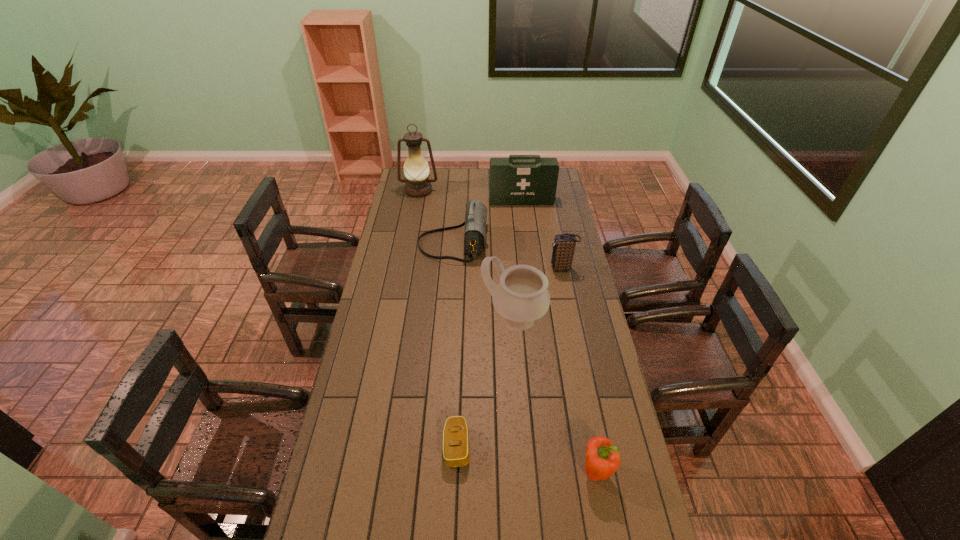
Where is `blank area located on the front-facing side of the first-aid kit`? The image size is (960, 540). blank area located on the front-facing side of the first-aid kit is located at coordinates (528, 254).

Where is `vacant space located 0.160m on the right of the fifth farthest object`? This screenshot has width=960, height=540. vacant space located 0.160m on the right of the fifth farthest object is located at coordinates (588, 319).

The height and width of the screenshot is (540, 960). Identify the location of vacant space positioned 0.390m on the front of the shoulder bag. (447, 332).

This screenshot has width=960, height=540. Find the location of `vacant space located 0.180m with the zip open on the right clutch bag`. vacant space located 0.180m with the zip open on the right clutch bag is located at coordinates (508, 268).

Where is `vacant position located with the zip open on the right clutch bag`? The width and height of the screenshot is (960, 540). vacant position located with the zip open on the right clutch bag is located at coordinates (519, 268).

Where is `free region located 0.080m with the zip open on the right clutch bag`? This screenshot has height=540, width=960. free region located 0.080m with the zip open on the right clutch bag is located at coordinates (531, 268).

Locate an element on the screen. This screenshot has height=540, width=960. vacant point located 0.070m on the right of the pepper is located at coordinates (636, 471).

Identify the location of free space located on the zipper side of the shorter clutch bag. This screenshot has height=540, width=960. (541, 446).

You are a GUI agent. You are given a task and a screenshot of the screen. Output one action in this format:
    pyautogui.click(x=<x>, y=<y>)
    Task: Click on the object located in the far edge section of the desktop
    
    Given the screenshot: What is the action you would take?
    pyautogui.click(x=416, y=169)

What are the coordinates of `object positioned at the left edge` in the screenshot? It's located at (416, 169).